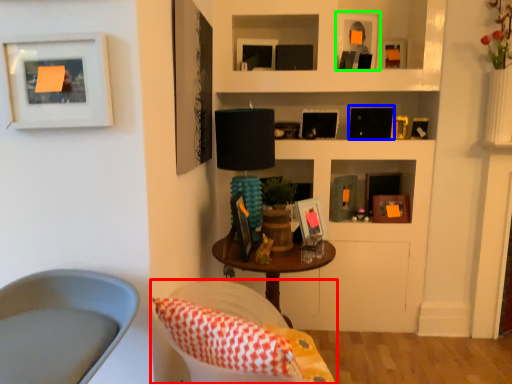
Question: Which is nearer to the chair (highlighted by a red box)? picture frame (highlighted by a blue box) or picture frame (highlighted by a green box).

Choices:
 (A) picture frame
 (B) picture frame

Answer: (A)